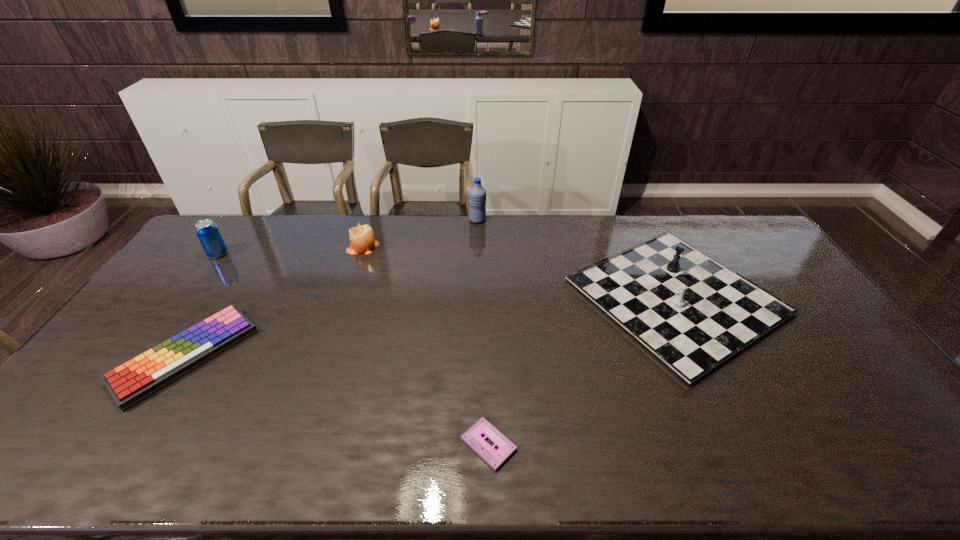
This screenshot has height=540, width=960. I want to click on the tallest object, so click(x=477, y=194).

At what (x,y) coordinates should I click in order to perform the action: click on water bottle. Please return your answer as a coordinate pair (x, y). Image resolution: width=960 pixels, height=540 pixels. Looking at the image, I should click on (477, 194).

Where is `beer can`? This screenshot has height=540, width=960. beer can is located at coordinates (207, 231).

Identify the location of the third object from left to right. (362, 239).

This screenshot has width=960, height=540. Find the location of `gameboard`. gameboard is located at coordinates (693, 313).

Locate an element on the screen. the second shortest object is located at coordinates (132, 382).

This screenshot has height=540, width=960. Find the location of `the shortest object`. the shortest object is located at coordinates (473, 437).

I want to click on videotape, so click(x=473, y=437).

Identify the location of vacant space located 0.270m on the front of the farthest object. The width and height of the screenshot is (960, 540). (477, 269).

Identify the location of free region located 0.280m on the front of the beer can. (172, 318).